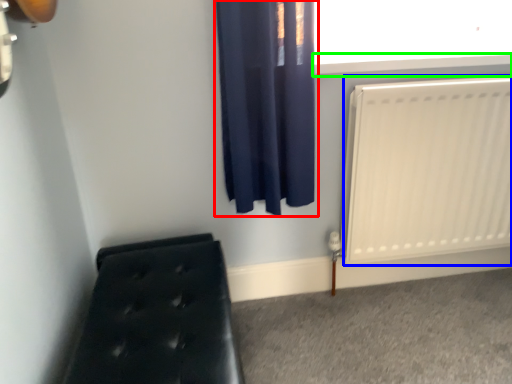
Question: Which object is positioned closest to curtain (highlighted by a red box)? Select from radiator (highlighted by a blue box) and window sill (highlighted by a green box).

Choices:
 (A) radiator
 (B) window sill

Answer: (B)